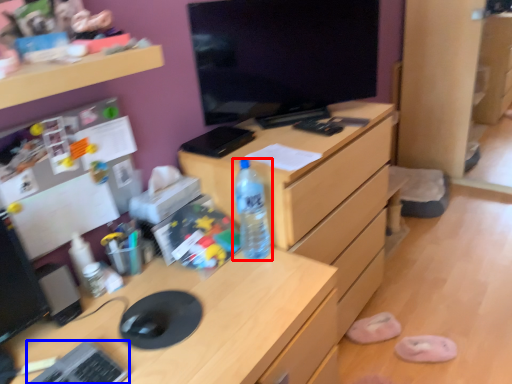
Question: Which of the following is the farthest to the observer, bottle (highlighted by a red box) or keyboard (highlighted by a blue box)?

Choices:
 (A) bottle
 (B) keyboard

Answer: (A)